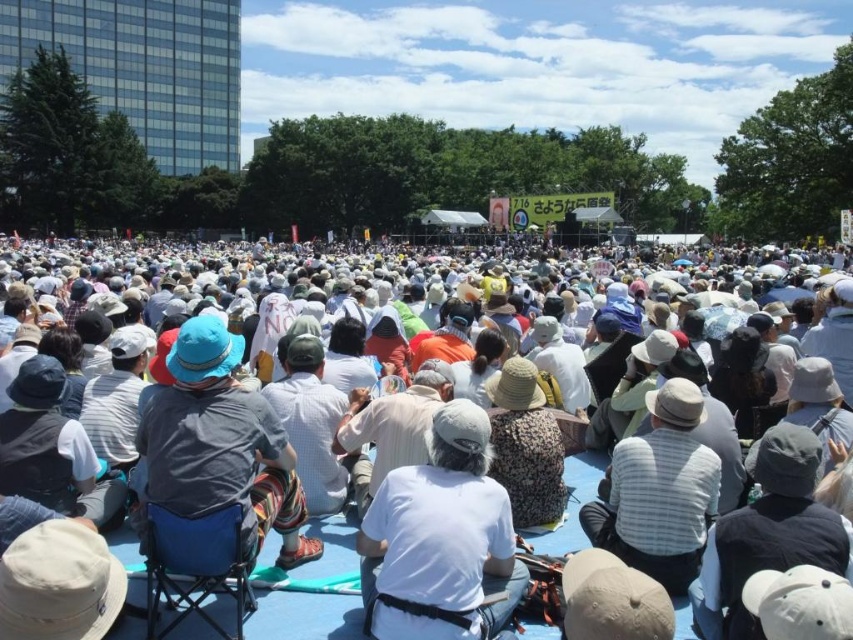
Question: Considering the relative positions of white fabric crowd at center and blue fabric chair at center in the image provided, where is white fabric crowd at center located with respect to blue fabric chair at center?

Choices:
 (A) right
 (B) left

Answer: (A)

Question: Which point appears closest to the camera in this image?

Choices:
 (A) (352, 576)
 (B) (647, 532)
 (C) (200, 476)

Answer: (C)

Question: Is white fabric at center to the left of striped fabric hat at center from the viewer's perspective?

Choices:
 (A) no
 (B) yes

Answer: (B)

Question: Among these points, which one is farthest from the camera?

Choices:
 (A) (672, 385)
 (B) (260, 400)

Answer: (A)

Question: Considering the relative positions of white fabric crowd at center and striped fabric hat at center in the image provided, where is white fabric crowd at center located with respect to striped fabric hat at center?

Choices:
 (A) right
 (B) left

Answer: (B)

Question: Which point is closer to the camera?

Choices:
 (A) white fabric at center
 (B) white fabric crowd at center
 (C) blue fabric chair at center

Answer: (A)